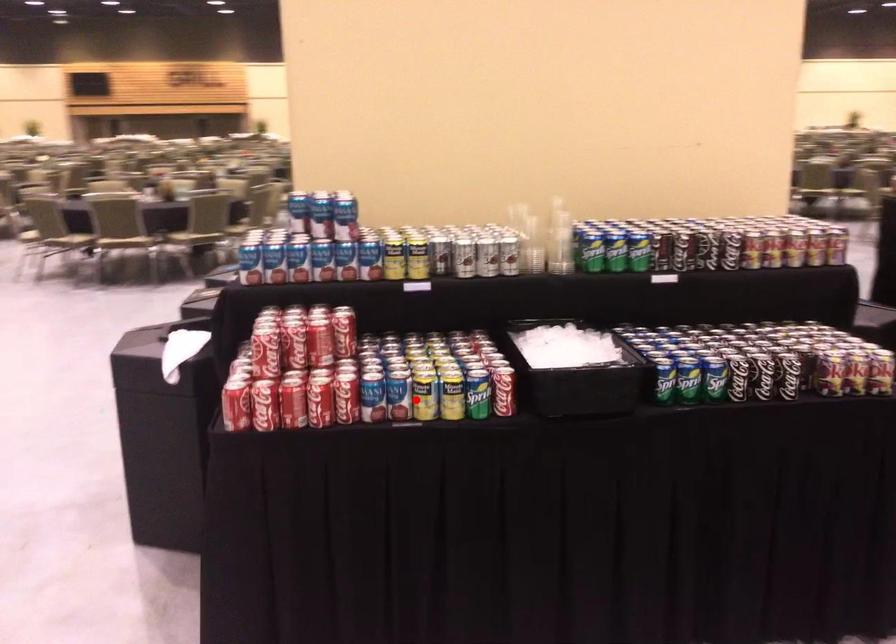
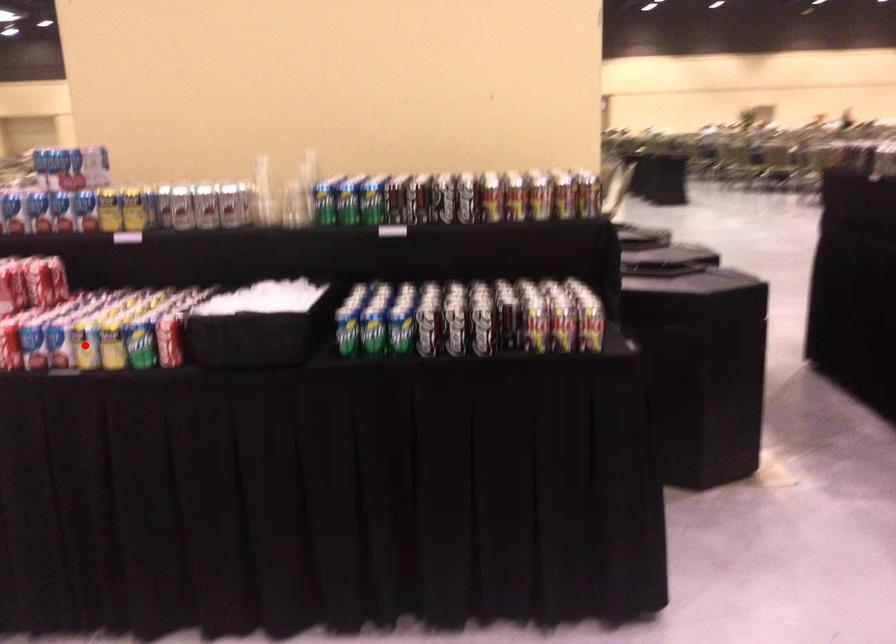
I am providing you with two images of the same scene from different viewpoints. A red point is marked on the first image and another point is marked on the second image. Does the point marked in image1 correspond to the same location as the one in image2?

Yes